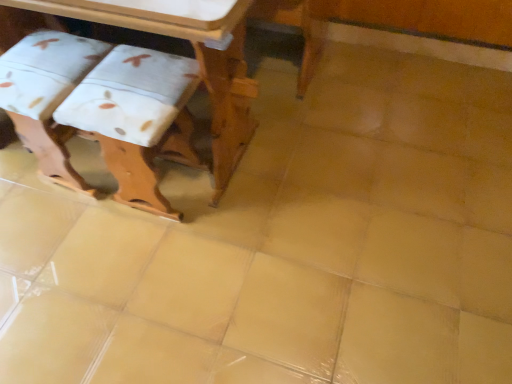
Question: Considering the relative positions of white fabric step stool at lower left, marked as the 1th step stool in a left-to-right arrangement, and white fabric step stool at left, which is counted as the second step stool, starting from the left, in the image provided, is white fabric step stool at lower left, marked as the 1th step stool in a left-to-right arrangement, to the left of white fabric step stool at left, which is counted as the second step stool, starting from the left, from the viewer's perspective?

Choices:
 (A) no
 (B) yes

Answer: (B)

Question: Is white fabric step stool at lower left, marked as the 1th step stool in a left-to-right arrangement, directly adjacent to white fabric step stool at left, arranged as the 1th step stool when viewed from the right?

Choices:
 (A) yes
 (B) no

Answer: (B)

Question: Could you tell me if white fabric step stool at lower left, marked as the 1th step stool in a left-to-right arrangement, is turned towards white fabric step stool at left, which is counted as the second step stool, starting from the left?

Choices:
 (A) no
 (B) yes

Answer: (A)

Question: Is white fabric step stool at lower left, arranged as the 2th step stool when viewed from the right, thinner than white fabric step stool at left, which is counted as the second step stool, starting from the left?

Choices:
 (A) no
 (B) yes

Answer: (B)

Question: Considering the relative sizes of white fabric step stool at lower left, arranged as the 2th step stool when viewed from the right, and white fabric step stool at left, arranged as the 1th step stool when viewed from the right, in the image provided, is white fabric step stool at lower left, arranged as the 2th step stool when viewed from the right, taller than white fabric step stool at left, arranged as the 1th step stool when viewed from the right,?

Choices:
 (A) yes
 (B) no

Answer: (B)

Question: Is point (144, 54) positioned closer to the camera than point (229, 69)?

Choices:
 (A) closer
 (B) farther

Answer: (B)

Question: Choose the correct answer: Is white fabric step stool at left, which is counted as the second step stool, starting from the left, inside wooden table at upper left or outside it?

Choices:
 (A) outside
 (B) inside

Answer: (B)

Question: In terms of size, does white fabric step stool at left, arranged as the 1th step stool when viewed from the right, appear bigger or smaller than wooden table at upper left?

Choices:
 (A) small
 (B) big

Answer: (A)

Question: From a real-world perspective, relative to wooden table at upper left, is white fabric step stool at left, which is counted as the second step stool, starting from the left, vertically above or below?

Choices:
 (A) below
 (B) above

Answer: (A)

Question: In terms of width, does wooden table at upper left look wider or thinner when compared to white fabric step stool at lower left, arranged as the 2th step stool when viewed from the right?

Choices:
 (A) thin
 (B) wide

Answer: (B)

Question: Is wooden table at upper left taller or shorter than white fabric step stool at lower left, marked as the 1th step stool in a left-to-right arrangement?

Choices:
 (A) short
 (B) tall

Answer: (B)

Question: Based on their positions, is wooden table at upper left located to the left or right of white fabric step stool at lower left, marked as the 1th step stool in a left-to-right arrangement?

Choices:
 (A) right
 (B) left

Answer: (A)

Question: From a real-world perspective, is wooden table at upper left positioned above or below white fabric step stool at lower left, arranged as the 2th step stool when viewed from the right?

Choices:
 (A) below
 (B) above

Answer: (B)

Question: Is white fabric step stool at left, arranged as the 1th step stool when viewed from the right, in front of or behind white fabric step stool at lower left, arranged as the 2th step stool when viewed from the right, in the image?

Choices:
 (A) behind
 (B) front

Answer: (B)

Question: From a real-world perspective, relative to white fabric step stool at lower left, arranged as the 2th step stool when viewed from the right, is white fabric step stool at left, arranged as the 1th step stool when viewed from the right, vertically above or below?

Choices:
 (A) below
 (B) above

Answer: (B)